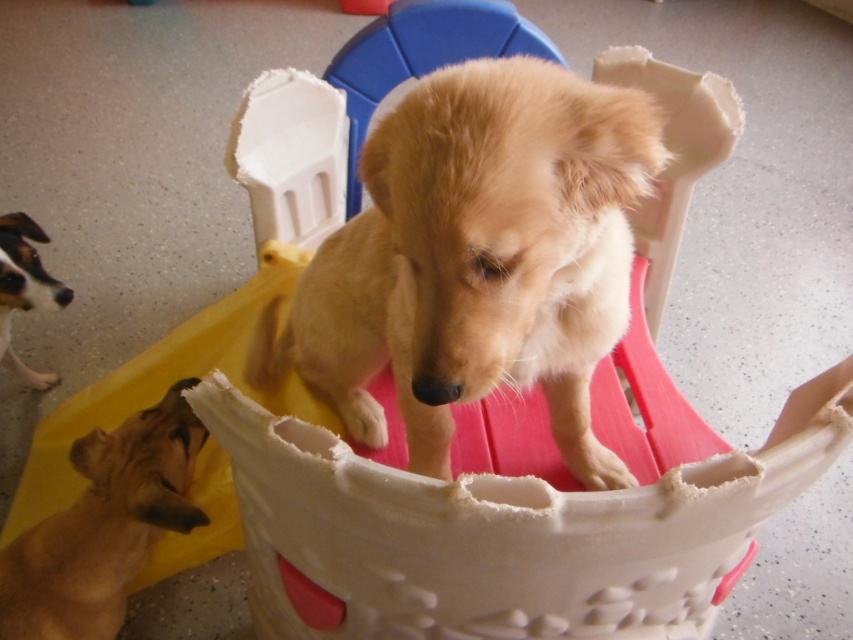
From the picture: Can you confirm if brown furry dog at upper center is wider than white fur dog at lower left?

Indeed, brown furry dog at upper center has a greater width compared to white fur dog at lower left.

Does brown furry dog at upper center come behind white fur dog at lower left?

No, it is in front of white fur dog at lower left.

Does point (42, 605) lie behind point (44, 288)?

No.

The height and width of the screenshot is (640, 853). I want to click on brown furry dog at upper center, so click(103, 525).

How far apart are golden fur puppy at center and white fur dog at lower left?

golden fur puppy at center and white fur dog at lower left are 35.46 inches apart.

Does point (567, 328) lie behind point (16, 284)?

No, (567, 328) is closer to viewer.

Locate an element on the screen. golden fur puppy at center is located at coordinates (479, 259).

Can you confirm if golden fur puppy at center is positioned to the right of brown furry dog at upper center?

Indeed, golden fur puppy at center is positioned on the right side of brown furry dog at upper center.

Is point (367, 356) in front of point (190, 436)?

That is True.

Who is more distant from viewer, (x=415, y=314) or (x=181, y=449)?

The point (x=181, y=449) is more distant.

Where is `golden fur puppy at center`? golden fur puppy at center is located at coordinates (479, 259).